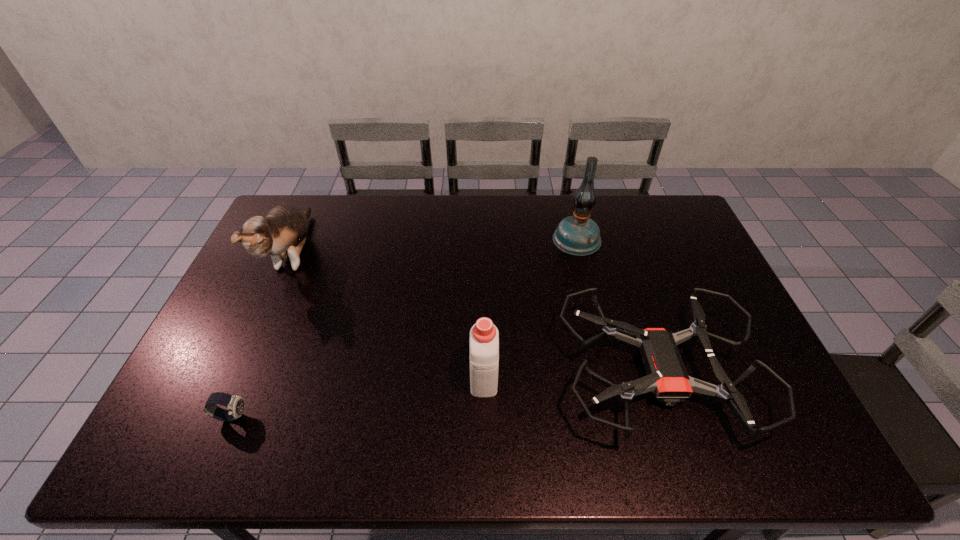
The width and height of the screenshot is (960, 540). What are the coordinates of `free point located on the handle side of the detergent` in the screenshot? It's located at (484, 317).

At what (x,y) coordinates should I click in order to perform the action: click on free spot located 0.250m with the camera facing forward on the drone. Please return your answer as a coordinate pair (x, y). This screenshot has height=540, width=960. Looking at the image, I should click on (465, 373).

Where is `vacant space located 0.240m with the camera facing forward on the drone`? Image resolution: width=960 pixels, height=540 pixels. vacant space located 0.240m with the camera facing forward on the drone is located at coordinates (468, 373).

Locate an element on the screen. The image size is (960, 540). vacant space situated with the camera facing forward on the drone is located at coordinates (438, 373).

This screenshot has width=960, height=540. I want to click on vacant position located 0.360m on the face of the shortest object, so click(396, 416).

The width and height of the screenshot is (960, 540). I want to click on oil lamp that is at the far edge, so click(579, 235).

The height and width of the screenshot is (540, 960). I want to click on cat at the far edge, so click(x=282, y=232).

Identify the location of drone located in the near edge section of the desktop. (667, 378).

At what (x,y) coordinates should I click in order to perform the action: click on watch located at the near edge. Please return your answer as a coordinate pair (x, y). The width and height of the screenshot is (960, 540). Looking at the image, I should click on (235, 404).

Identify the location of cat located at the left edge. The width and height of the screenshot is (960, 540). (282, 232).